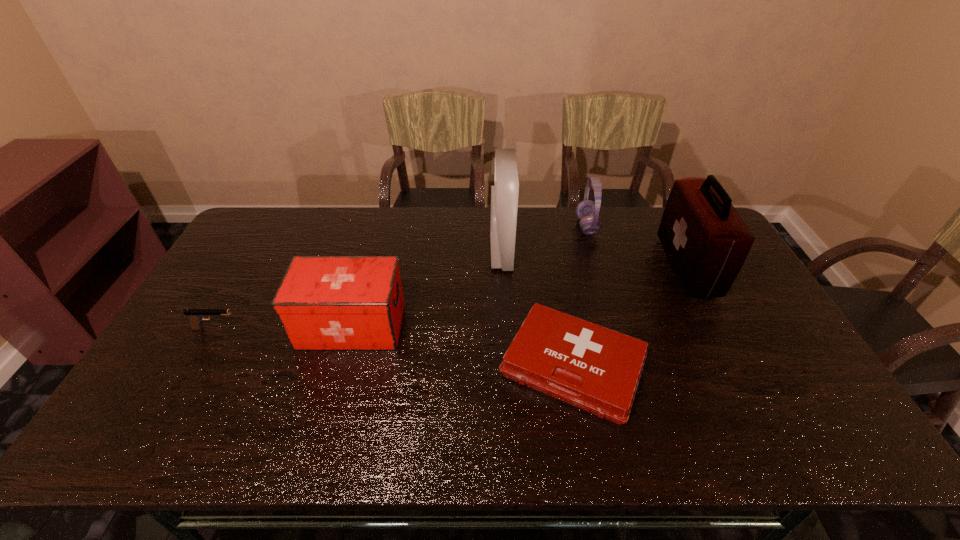
At what (x,y) coordinates should I click in order to perform the action: click on the rightmost object. Please return your answer as a coordinate pair (x, y). This screenshot has height=540, width=960. Looking at the image, I should click on (706, 241).

I want to click on headset, so click(x=587, y=211).

At what (x,y) coordinates should I click in order to perform the action: click on the third tallest first-aid kit. Please return your answer as a coordinate pair (x, y). Image resolution: width=960 pixels, height=540 pixels. Looking at the image, I should click on (323, 302).

Identify the location of the leftmost first-aid kit. The image size is (960, 540). (323, 302).

Identify the location of the leftmost object. The height and width of the screenshot is (540, 960). (195, 316).

Locate an element on the screen. The image size is (960, 540). the fifth tallest object is located at coordinates (195, 316).

Where is `the shortest object`? The image size is (960, 540). the shortest object is located at coordinates (597, 369).

Image resolution: width=960 pixels, height=540 pixels. Identify the location of vacant area located on the side of the rightmost first-aid kit with the cross symbol. (579, 266).

Image resolution: width=960 pixels, height=540 pixels. I want to click on vacant space situated on the side of the rightmost first-aid kit with the cross symbol, so click(564, 266).

The image size is (960, 540). I want to click on vacant position located on the side of the rightmost first-aid kit with the cross symbol, so click(x=572, y=266).